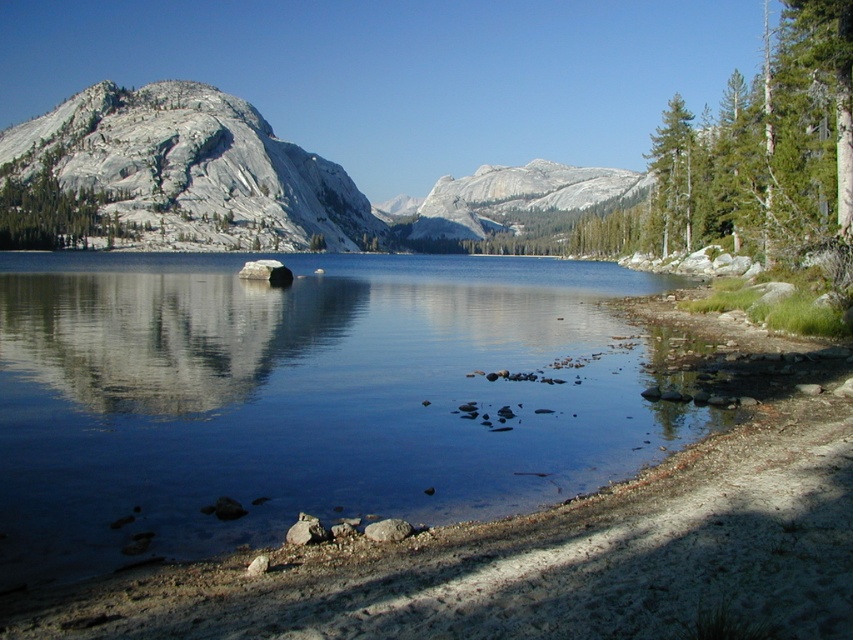
Identify the location of granite mountain at center. The image size is (853, 640). (508, 196).

Who is shorter, granite mountain at center or smooth gray rock at upper left?

Standing shorter between the two is smooth gray rock at upper left.

The width and height of the screenshot is (853, 640). What do you see at coordinates (508, 196) in the screenshot?
I see `granite mountain at center` at bounding box center [508, 196].

Locate an element on the screen. granite mountain at center is located at coordinates (508, 196).

Does granite mountain at center appear on the left side of green textured pine tree at right?

Correct, you'll find granite mountain at center to the left of green textured pine tree at right.

This screenshot has width=853, height=640. What do you see at coordinates (508, 196) in the screenshot? I see `granite mountain at center` at bounding box center [508, 196].

This screenshot has height=640, width=853. Find the location of `granite mountain at center`. granite mountain at center is located at coordinates (508, 196).

Who is lower down, green textured tree at right or smooth gray rock at upper left?

smooth gray rock at upper left

Between point (727, 163) and point (120, 236), which one is positioned in front?

Point (727, 163)

Is point (647, 204) closer to viewer compared to point (13, 224)?

No, it is not.

At what (x,y) coordinates should I click in order to perform the action: click on green textured tree at right. Please return your answer as a coordinate pair (x, y). Looking at the image, I should click on (753, 154).